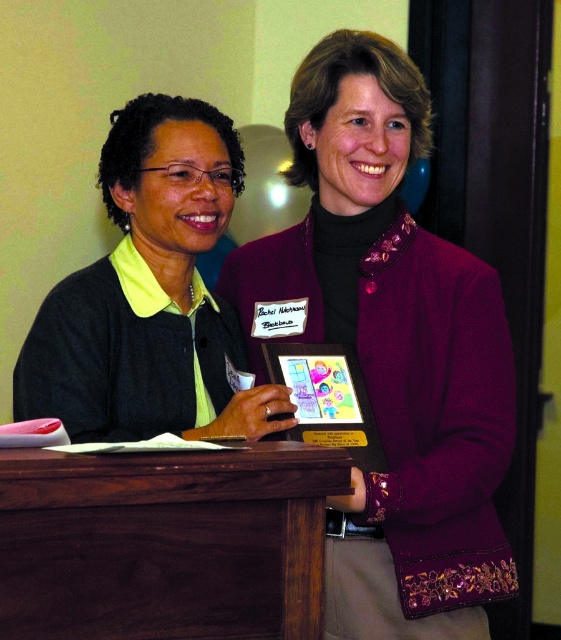
Based on the photo, you are standing in a room where the purple satin jacket at center is displayed. If you want to reach into your pocket to retrieve a small item without moving your body, can you do so while keeping your hand visible in the frame?

The purple satin jacket at center is 4.41 feet away from the viewer, so yes, you can reach into your pocket while keeping your hand visible in the frame since the distance allows for such a movement.

You are a photographer setting up a shot in this scene. You need to place a small prop on the purple satin jacket at center and the dark brown wood table at center. Which object allows you to place the prop higher up?

The purple satin jacket at center is located above the dark brown wood table at center, so placing the prop on the purple satin jacket at center will position it higher up.

You are a photographer setting up for a group photo. You have two outfits to choose from for the subjects. The first is the purple satin jacket at center, and the second is the matte black sweater at center. The camera frame can accommodate a maximum width of 45 cm. According to the scene description, which outfit would you recommend to ensure it fits within the frame?

The purple satin jacket at center is wider than the matte black sweater at center. Since the camera frame can only accommodate up to 45 cm, the matte black sweater at center would be the better choice as it is narrower and more likely to fit within the frame.